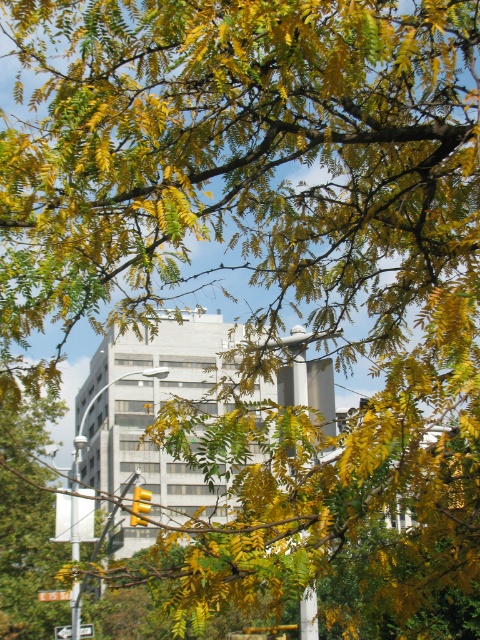
You are a city planner assessing the space between the metallic pole at left and the white plastic arrow at lower left. If you need to install a new rectangular sign that is 1 meter wide, will there be enough space between them?

The metallic pole at left is wider than the white plastic arrow at lower left, so the space between them may vary depending on their exact positions. However, since the sign is 1 meter wide, it is advisable to measure the actual distance between the two objects to ensure compatibility.

You are a pedestrian standing at the intersection and see the metallic pole at left and the white plastic arrow at lower left. Which object is nearer to you?

The metallic pole at left is closer to the viewer than the white plastic arrow at lower left.

You are standing at the center of the image and want to locate the metallic pole at left. Which cardinal direction should you face to see it?

The metallic pole at left is located at the lower left part of the image, so you should face the west direction to see it.